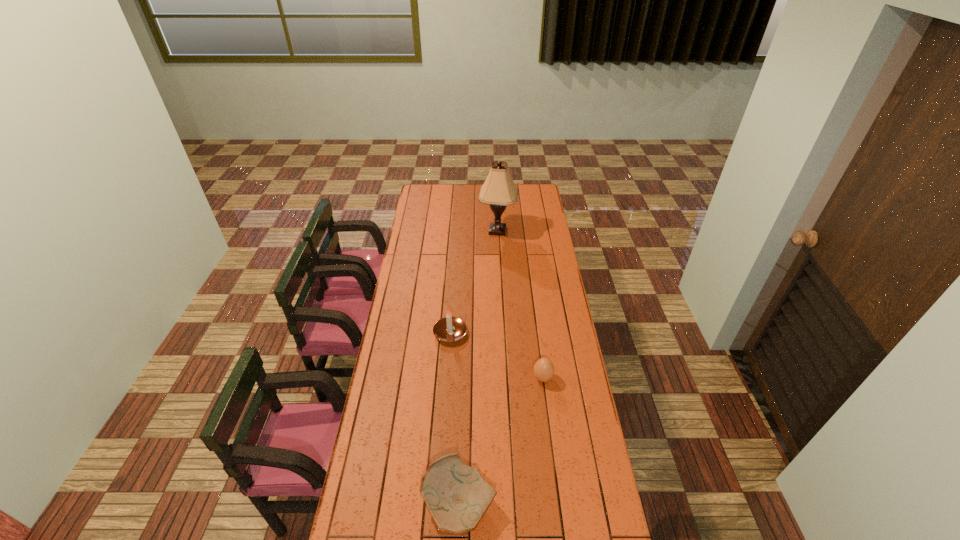
Locate an element on the screen. empty location between the lamp and the candle is located at coordinates (473, 282).

Locate an element on the screen. object that stands as the closest to the farthest object is located at coordinates (449, 329).

Identify which object is the second nearest to the second farthest object. Please provide its 2D coordinates. Your answer should be formatted as a tuple, i.e. [(x, y)], where the tuple contains the x and y coordinates of a point satisfying the conditions above.

[(457, 496)]

This screenshot has height=540, width=960. In order to click on free space that satisfies the following two spatial constraints: 1. on the front side of the lamp; 2. on the right side of the boiled egg in this screenshot , I will do `click(505, 378)`.

Locate an element on the screen. vacant space that satisfies the following two spatial constraints: 1. on the front side of the third farthest object; 2. on the left side of the farthest object is located at coordinates (505, 378).